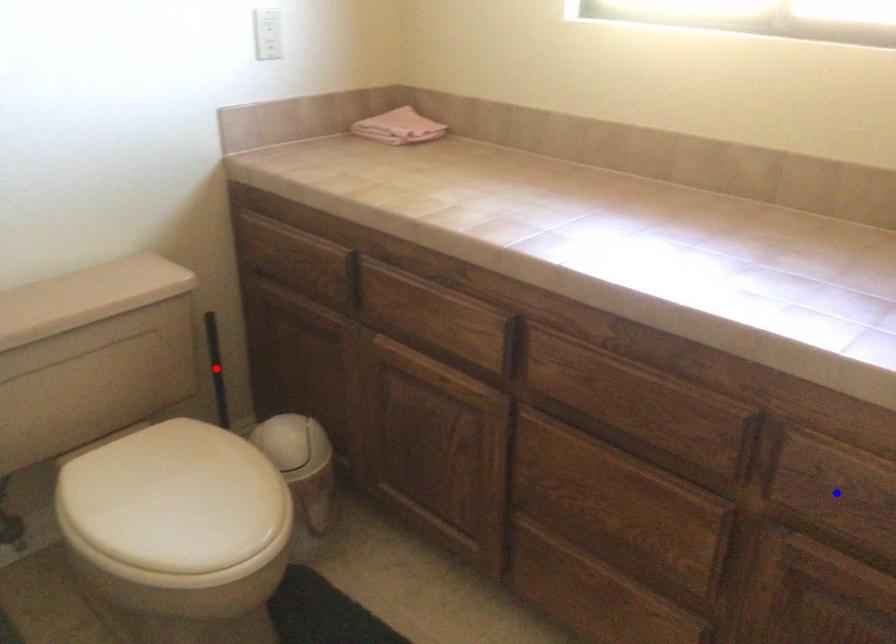
Question: In the image, two points are highlighted. Which point is nearer to the camera? Reply with the corresponding letter.

Choices:
 (A) blue point
 (B) red point

Answer: (A)